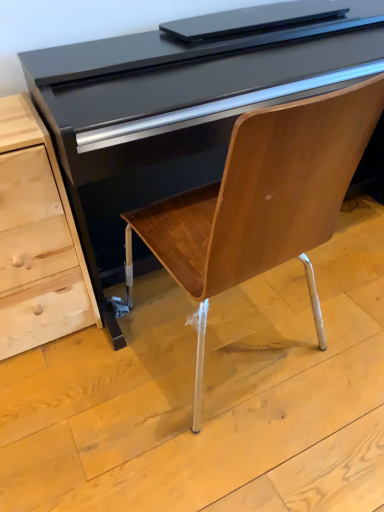
Question: Is glossy black piano at center inside the boundaries of light wood chest of drawers at left, or outside?

Choices:
 (A) inside
 (B) outside

Answer: (B)

Question: Is glossy black piano at center bigger or smaller than light wood chest of drawers at left?

Choices:
 (A) big
 (B) small

Answer: (A)

Question: From the image's perspective, is glossy black piano at center positioned above or below light wood chest of drawers at left?

Choices:
 (A) above
 (B) below

Answer: (A)

Question: From their relative heights in the image, would you say light wood chest of drawers at left is taller or shorter than glossy black piano at center?

Choices:
 (A) short
 (B) tall

Answer: (A)

Question: From a real-world perspective, relative to glossy black piano at center, is light wood chest of drawers at left vertically above or below?

Choices:
 (A) above
 (B) below

Answer: (B)

Question: Is point (43, 238) positioned closer to the camera than point (163, 117)?

Choices:
 (A) closer
 (B) farther

Answer: (B)

Question: Considering the positions of light wood chest of drawers at left and glossy black piano at center in the image, is light wood chest of drawers at left bigger or smaller than glossy black piano at center?

Choices:
 (A) big
 (B) small

Answer: (B)